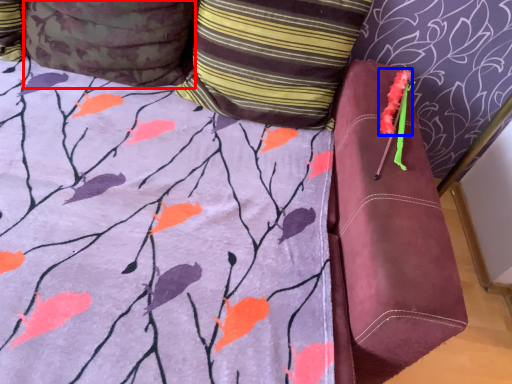
Question: Among these objects, which one is farthest to the camera, pillow (highlighted by a red box) or flower (highlighted by a blue box)?

Choices:
 (A) pillow
 (B) flower

Answer: (B)